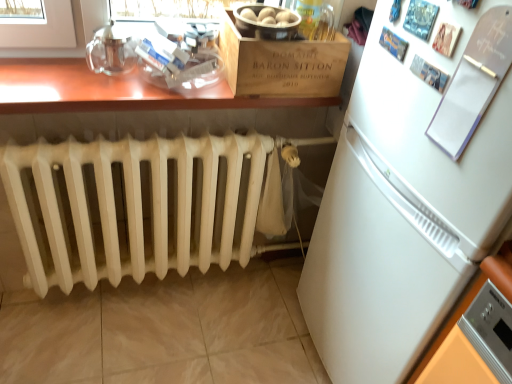
Question: From the image's perspective, is white painted radiator at lower left on top of wooden crate at upper center?

Choices:
 (A) no
 (B) yes

Answer: (A)

Question: Considering the relative sizes of white painted radiator at lower left and wooden crate at upper center in the image provided, is white painted radiator at lower left wider than wooden crate at upper center?

Choices:
 (A) no
 (B) yes

Answer: (A)

Question: Is white painted radiator at lower left not close to wooden crate at upper center?

Choices:
 (A) yes
 (B) no

Answer: (B)

Question: Is white painted radiator at lower left closer to the viewer compared to wooden crate at upper center?

Choices:
 (A) no
 (B) yes

Answer: (B)

Question: Considering the relative sizes of white painted radiator at lower left and wooden crate at upper center in the image provided, is white painted radiator at lower left bigger than wooden crate at upper center?

Choices:
 (A) no
 (B) yes

Answer: (B)

Question: Is white painted radiator at lower left positioned with its back to wooden crate at upper center?

Choices:
 (A) yes
 (B) no

Answer: (B)

Question: Is wooden table at upper center at the back of white paperboard at upper right?

Choices:
 (A) no
 (B) yes

Answer: (A)

Question: Is white paperboard at upper right closer to the viewer compared to wooden table at upper center?

Choices:
 (A) no
 (B) yes

Answer: (B)

Question: Is white paperboard at upper right completely or partially outside of wooden table at upper center?

Choices:
 (A) no
 (B) yes

Answer: (B)

Question: From the image's perspective, is white paperboard at upper right over wooden table at upper center?

Choices:
 (A) yes
 (B) no

Answer: (B)

Question: Can you confirm if white paperboard at upper right is thinner than wooden table at upper center?

Choices:
 (A) no
 (B) yes

Answer: (B)

Question: Is white paperboard at upper right far from wooden table at upper center?

Choices:
 (A) yes
 (B) no

Answer: (B)

Question: Is white paperboard at upper right surrounded by white matte refrigerator at right?

Choices:
 (A) yes
 (B) no

Answer: (A)